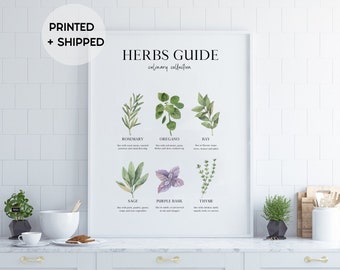
This screenshot has width=340, height=270. Identify the location of marble countertop. (192, 245).